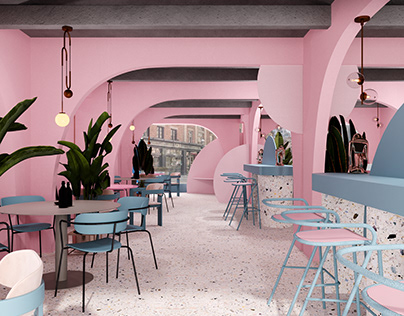
Locate an element on the screen. This screenshot has height=316, width=404. area to sit is located at coordinates (328, 233), (95, 245).